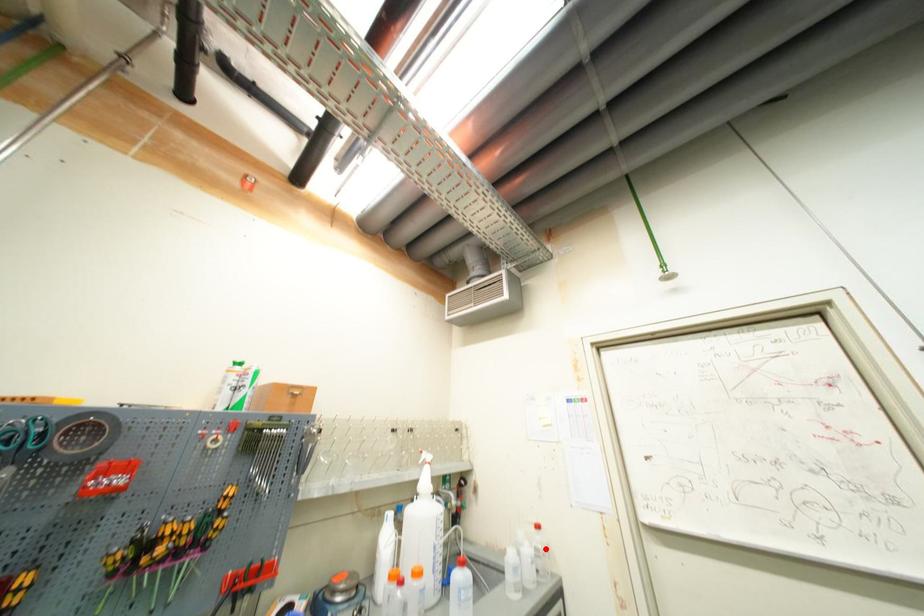
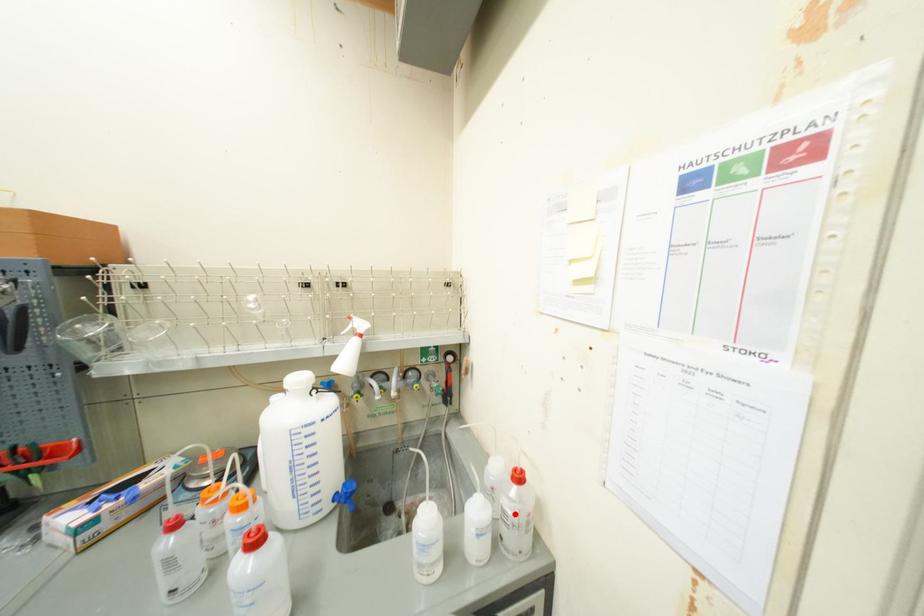
I am providing you with two images of the same scene from different viewpoints. A red point is marked on the first image and another point is marked on the second image. Does the point marked in image1 correspond to the same location as the one in image2?

Yes